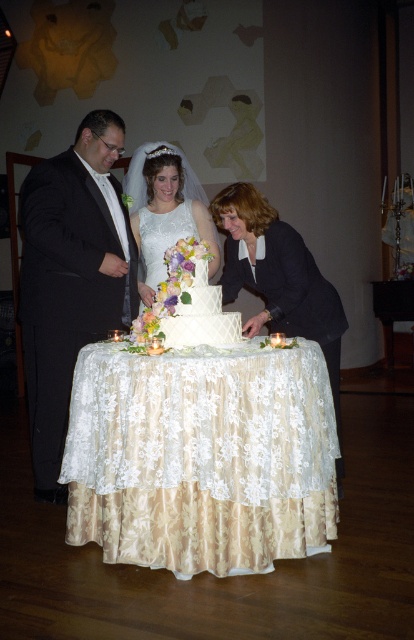
You are a photographer at the wedding and need to capture a closeup shot of the lace fabric tablecloth at center and the matte black jacket at center. Since the camera can only focus on one object at a time, which object should you adjust the focus to first if you want to ensure the larger object is in focus?

The lace fabric tablecloth at center is larger in width than the matte black jacket at center, so you should adjust the focus to the lace fabric tablecloth at center first to ensure the larger object is in focus.

What is located at the point with coordinates [202,456] in the wedding scene?

The point at coordinates [202,456] indicates the lace fabric tablecloth at center.

You are a photographer adjusting your camera settings to focus on two points in the wedding scene. The first point is at coordinates point [247,380], and the second is at point [177,232]. Which point should you focus on first if you want to capture the closest object to the camera?

Point [247,380] is closer to the camera than point [177,232], so you should focus on point [247,380] first to capture the closest object.